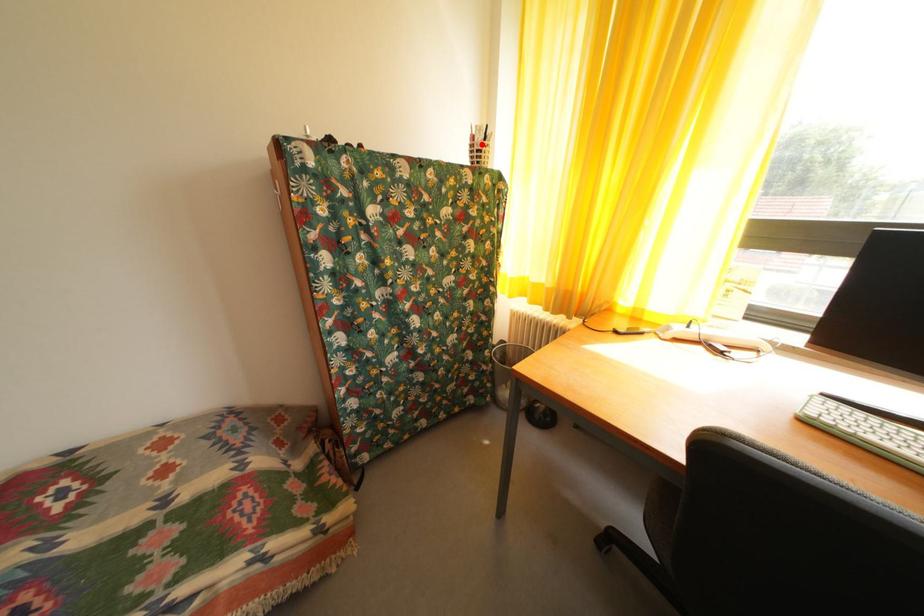
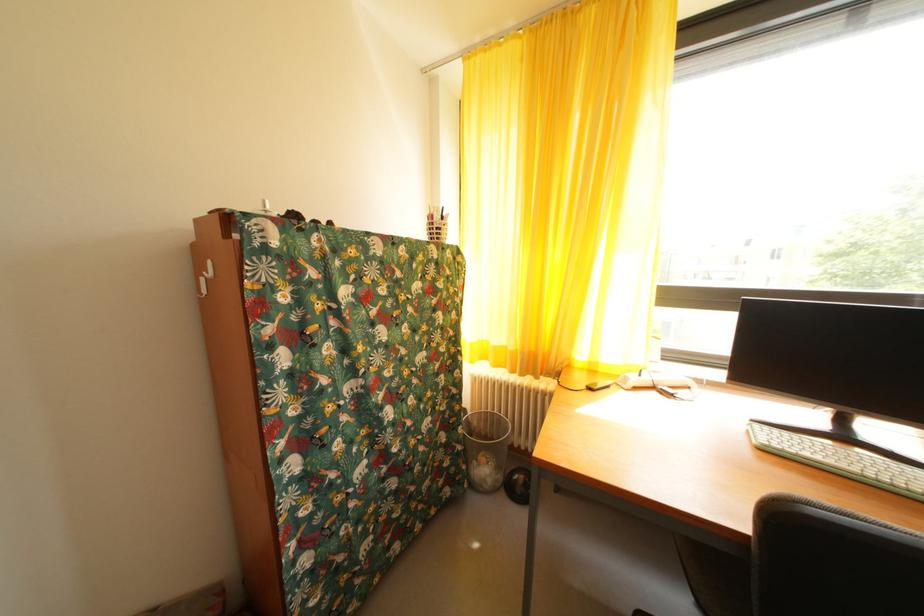
The point at the highlighted location is marked in the first image. Where is the corresponding point in the second image?

(440, 223)